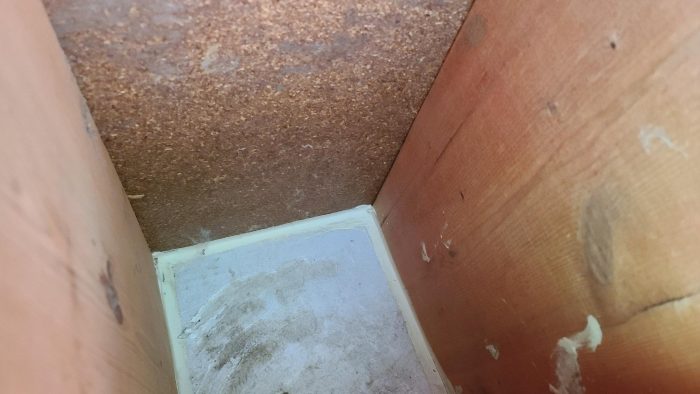
Where is `white paint`? This screenshot has width=700, height=394. white paint is located at coordinates (593, 339).